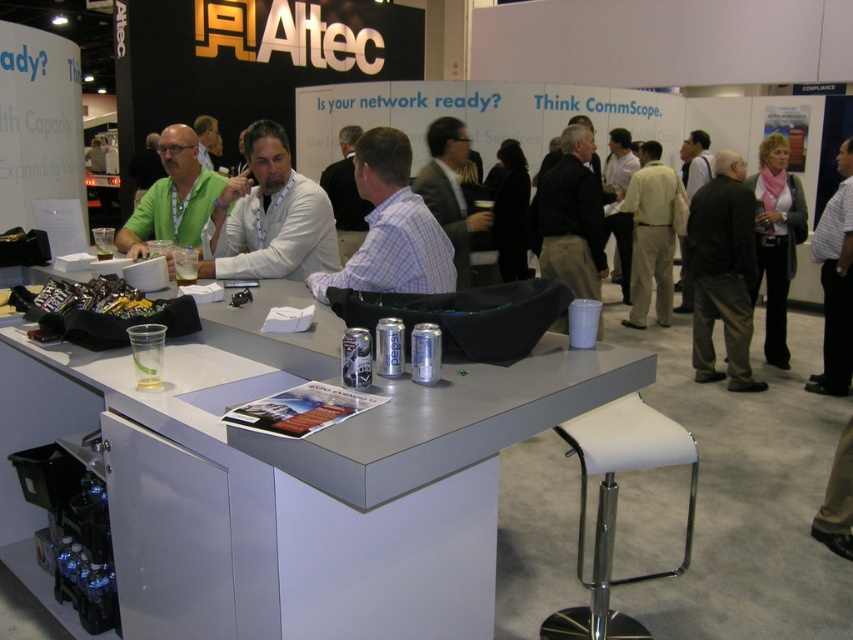
You are a photographer at the exhibition. You need to capture both the white checkered shirt at center and the black fabric jacket at center in a single frame. Which clothing item will appear smaller in the photo?

The white checkered shirt at center will appear smaller in the photo because it has a smaller size compared to the black fabric jacket at center.

You are organizing a trade show booth and need to decide which clothing item to display first. The black fabric jacket at center and the matte green shirt at center are both on display. Based on their sizes, which one should you choose to take up more space?

The matte green shirt at center is wider than the black fabric jacket at center, so you should choose the matte green shirt at center to take up more space.

You are a photographer at the exhibition and need to decide which clothing item to focus on for a closeup. Since the white checkered shirt at center and the black fabric jacket at center are both centered, which one would you choose if you want to capture the wider item?

The white checkered shirt at center is wider than the black fabric jacket at center, so you should focus on the white checkered shirt at center for the closeup to capture the wider item.